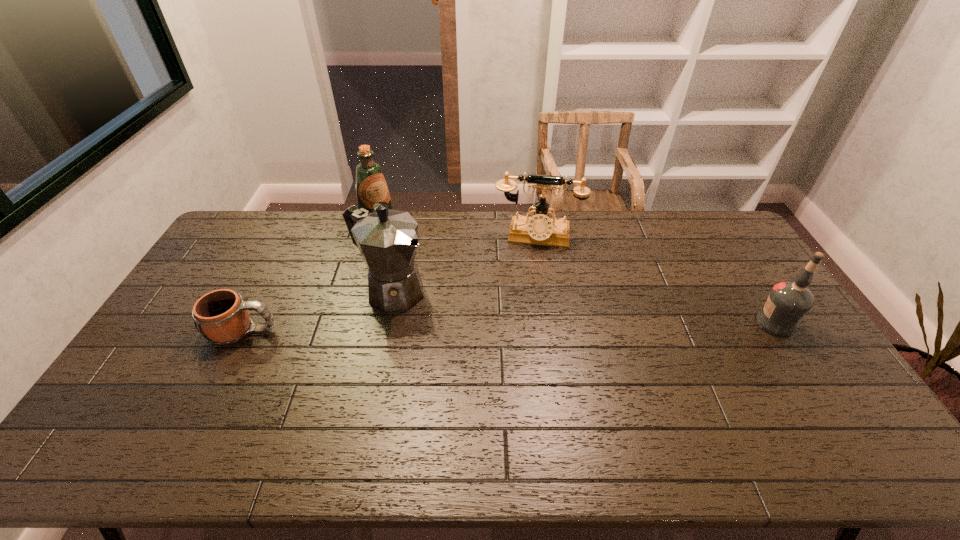
Find the location of a particular element. This screenshot has width=960, height=540. free spot located on the front-facing side of the olive oil is located at coordinates (442, 290).

This screenshot has height=540, width=960. Identify the location of free space located 0.260m on the front-facing side of the olive oil. (428, 277).

Where is `vacant space located on the front-facing side of the olive oil`? Image resolution: width=960 pixels, height=540 pixels. vacant space located on the front-facing side of the olive oil is located at coordinates (422, 271).

This screenshot has height=540, width=960. In order to click on vacant space situated 0.190m on the dial of the telephone in this screenshot , I will do `click(530, 285)`.

This screenshot has height=540, width=960. What are the coordinates of `vacant space located on the dial of the telephone` in the screenshot? It's located at (528, 295).

Locate an element on the screen. free location located on the dial of the telephone is located at coordinates (532, 258).

The height and width of the screenshot is (540, 960). I want to click on vacant space located 0.330m on the pouring side of the coffeepot, so click(506, 355).

At what (x,y) coordinates should I click in order to perform the action: click on vacant area located 0.220m on the pouring side of the coffeepot. Please return your answer as a coordinate pair (x, y). The image size is (960, 540). Looking at the image, I should click on (475, 337).

Where is `vacant region located on the pouring side of the coffeepot`? This screenshot has height=540, width=960. vacant region located on the pouring side of the coffeepot is located at coordinates (469, 334).

At what (x,y) coordinates should I click in order to perform the action: click on olive oil present at the far edge. Please return your answer as a coordinate pair (x, y). This screenshot has height=540, width=960. Looking at the image, I should click on (371, 187).